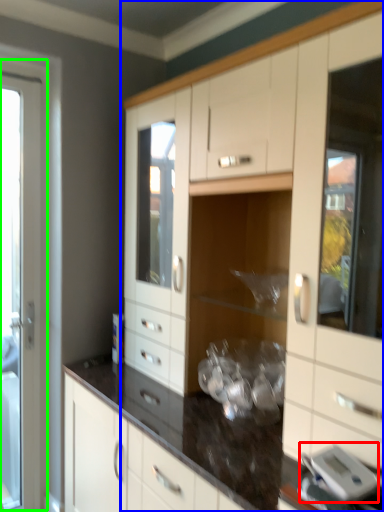
Question: Which object is the closest to the appliance (highlighted by a red box)? Choose among these: cabinetry (highlighted by a blue box) or screen door (highlighted by a green box).

Choices:
 (A) cabinetry
 (B) screen door

Answer: (A)